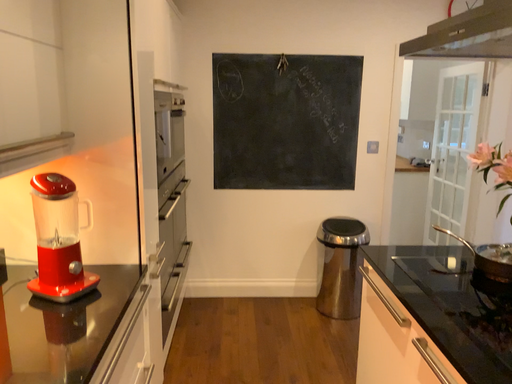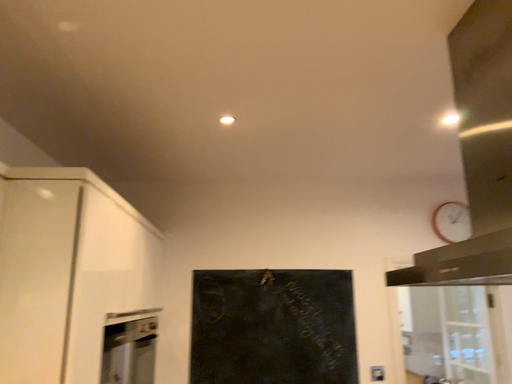
Question: How did the camera likely rotate when shooting the video?

Choices:
 (A) rotated upward
 (B) rotated downward

Answer: (A)